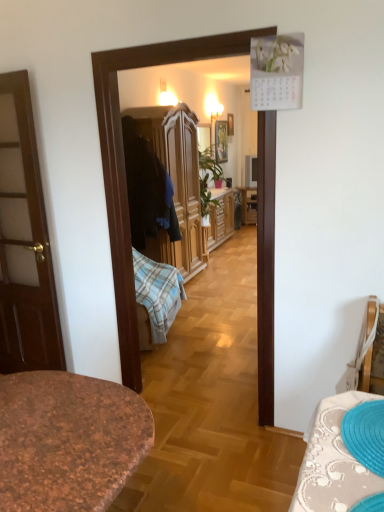
Question: Can you confirm if matte black television at center is taller than wooden wardrobe at center?

Choices:
 (A) yes
 (B) no

Answer: (B)

Question: Can you confirm if matte black television at center is positioned to the left of wooden wardrobe at center?

Choices:
 (A) yes
 (B) no

Answer: (B)

Question: Is the depth of matte black television at center greater than that of wooden wardrobe at center?

Choices:
 (A) yes
 (B) no

Answer: (A)

Question: From a real-world perspective, does matte black television at center sit lower than wooden wardrobe at center?

Choices:
 (A) no
 (B) yes

Answer: (B)

Question: Is matte black television at center not inside wooden wardrobe at center?

Choices:
 (A) no
 (B) yes

Answer: (B)

Question: In terms of width, does matte black television at center look wider or thinner when compared to wooden picture frame at center, marked as the 1th picture frame in a left-to-right arrangement?

Choices:
 (A) thin
 (B) wide

Answer: (B)

Question: From a real-world perspective, relative to wooden picture frame at center, which appears as the 2th picture frame when viewed from the right, is matte black television at center vertically above or below?

Choices:
 (A) below
 (B) above

Answer: (A)

Question: Is matte black television at center taller or shorter than wooden picture frame at center, marked as the 1th picture frame in a left-to-right arrangement?

Choices:
 (A) short
 (B) tall

Answer: (A)

Question: From the image's perspective, relative to wooden picture frame at center, which appears as the 2th picture frame when viewed from the right, is matte black television at center above or below?

Choices:
 (A) above
 (B) below

Answer: (B)

Question: Looking at the image, does wooden wardrobe at center seem bigger or smaller compared to matte black television at center?

Choices:
 (A) small
 (B) big

Answer: (B)

Question: Is wooden wardrobe at center spatially inside matte black television at center, or outside of it?

Choices:
 (A) inside
 (B) outside

Answer: (B)

Question: In the image, is wooden wardrobe at center on the left side or the right side of matte black television at center?

Choices:
 (A) right
 (B) left

Answer: (B)

Question: In terms of height, does wooden wardrobe at center look taller or shorter compared to matte black television at center?

Choices:
 (A) tall
 (B) short

Answer: (A)

Question: Is wooden picture frame at upper center, which ranks as the first picture frame in right-to-left order, wider or thinner than wooden wardrobe at center?

Choices:
 (A) wide
 (B) thin

Answer: (B)

Question: Is wooden picture frame at upper center, which ranks as the second picture frame in left-to-right order, inside or outside of wooden wardrobe at center?

Choices:
 (A) inside
 (B) outside

Answer: (B)